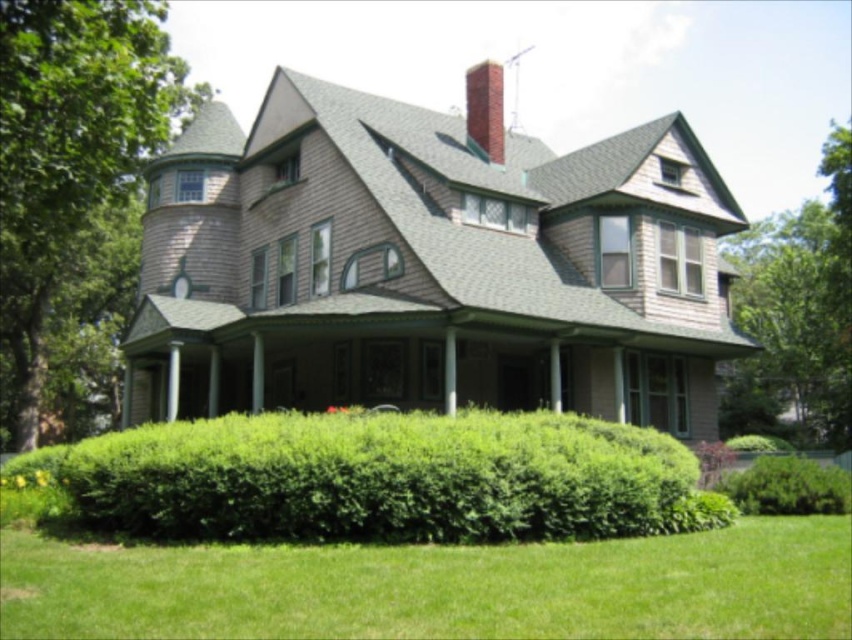
You are a gardener planning to trim the green leafy hedge at lower center and the green leafy hedge at lower right. Based on their sizes, which hedge requires more time to trim?

The green leafy hedge at lower center requires more time to trim because its width is larger than the green leafy hedge at lower right.

You are a landscape designer planning to add a new garden bed between the green leafy hedge at lower center and the green leafy tree at upper right. Which of the two plants should you consider removing to make space for the garden bed?

The green leafy hedge at lower center should be removed because it occupies less space than the green leafy tree at upper right, making it easier to remove without significantly impacting the landscape.